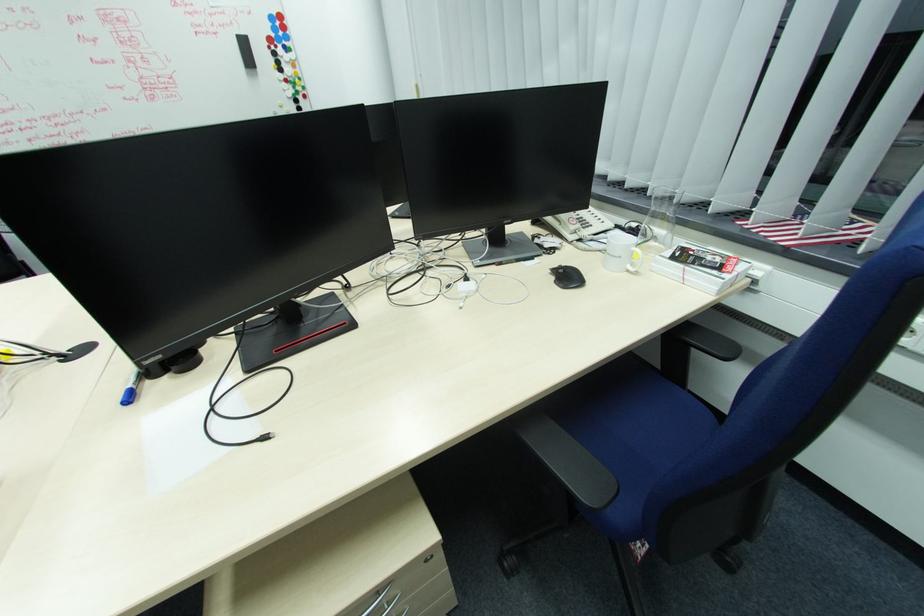
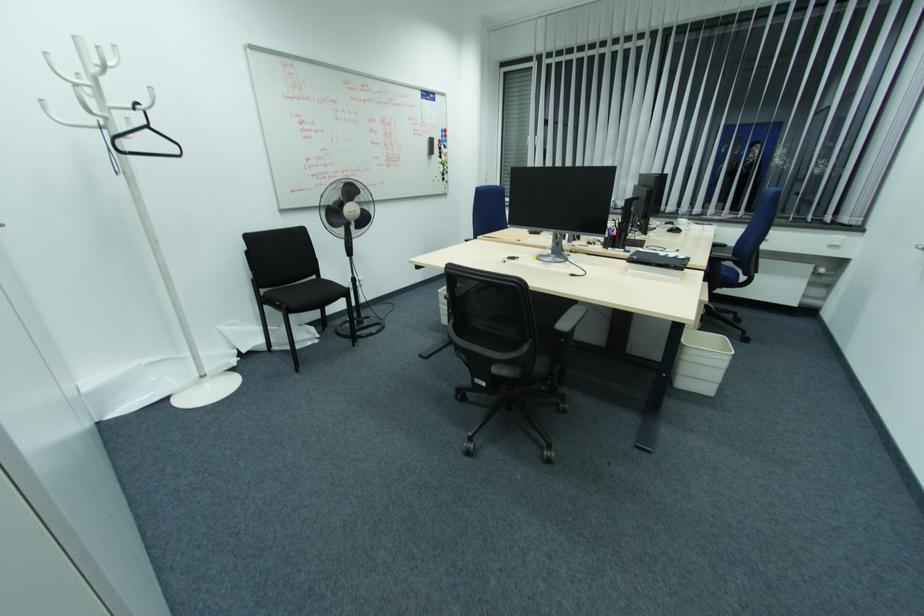
Locate, in the second image, the point that corresponds to point (286, 44) in the first image.

(445, 144)